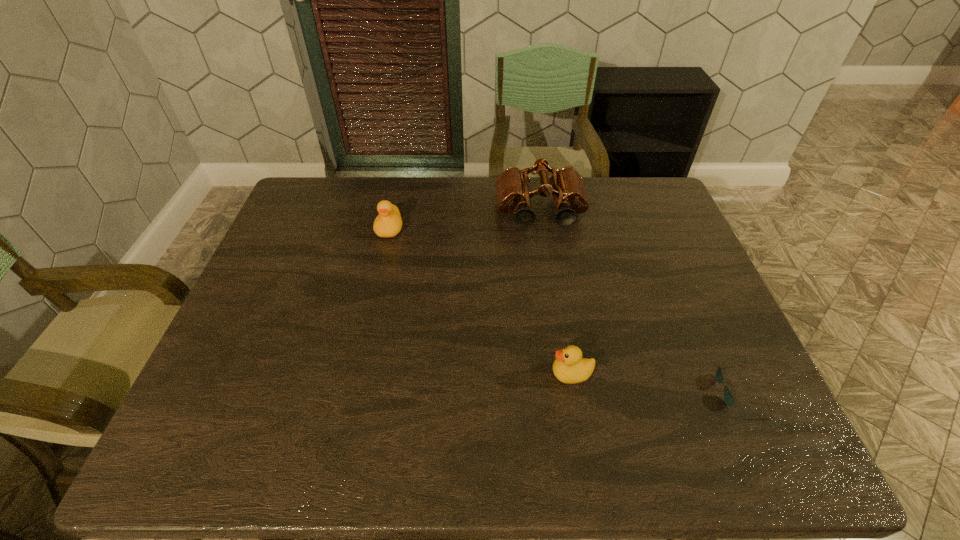
Image resolution: width=960 pixels, height=540 pixels. I want to click on free space at the right edge of the desktop, so click(x=681, y=262).

Where is `free space at the far left corner of the desktop`? Image resolution: width=960 pixels, height=540 pixels. free space at the far left corner of the desktop is located at coordinates (319, 217).

At what (x,y) coordinates should I click in order to perform the action: click on vacant space at the far right corner. Please return your answer as a coordinate pair (x, y). The image size is (960, 540). Looking at the image, I should click on (628, 184).

This screenshot has width=960, height=540. I want to click on empty location between the tallest object and the right duck, so click(x=556, y=292).

Identify the location of vacant area between the tallest object and the right duck. This screenshot has width=960, height=540. (556, 292).

The width and height of the screenshot is (960, 540). Identify the location of free point between the sunglasses and the right duck. 655,382.

Locate an element on the screen. The image size is (960, 540). vacant point located between the rightmost object and the right duck is located at coordinates (655, 382).

Identify the location of free spot between the tallest object and the nearer duck. This screenshot has height=540, width=960. (556, 292).

In order to click on free space between the shortest object and the nearer duck in this screenshot , I will do `click(655, 382)`.

Where is `vacant space that is in between the leftmost object and the nearer duck`? vacant space that is in between the leftmost object and the nearer duck is located at coordinates (481, 301).